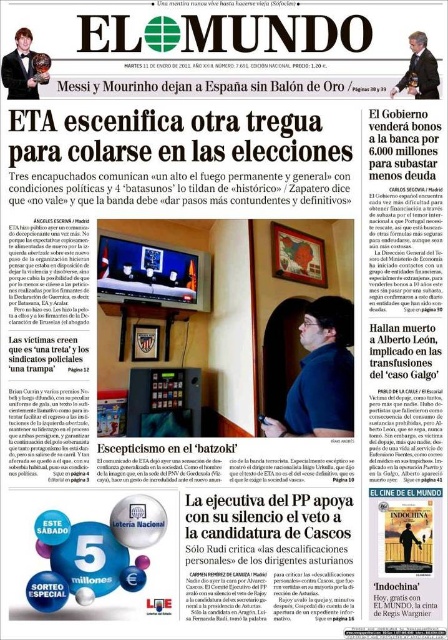
You are a journalist examining the front page of El Mundo from January 11, 2011. You notice the black plastic phone at center and the shiny black tuxedo at upper left. Which object is positioned closer to the front of the page?

The black plastic phone at center is closer to the viewer than the shiny black tuxedo at upper left, so the black plastic phone at center is positioned closer to the front of the page.

You are a photographer standing 2 meters away from the newspaper. You want to take a closeup of the point at coordinates point (x=275, y=420). Can you do so without moving closer than 1.4 meters from the newspaper?

The distance of point (x=275, y=420) from camera is 1.49 meters, so yes, you can take the closeup without moving closer than 1.4 meters because the point is already 1.49 meters away from the photographer.

You are a journalist who needs to take a photo of the front page of El Mundo. You have a black plastic phone at center and a suit at upper right in your frame. Which object will occupy more space in the photo?

The black plastic phone at center has a larger size compared to the suit at upper right, so it will occupy more space in the photo.